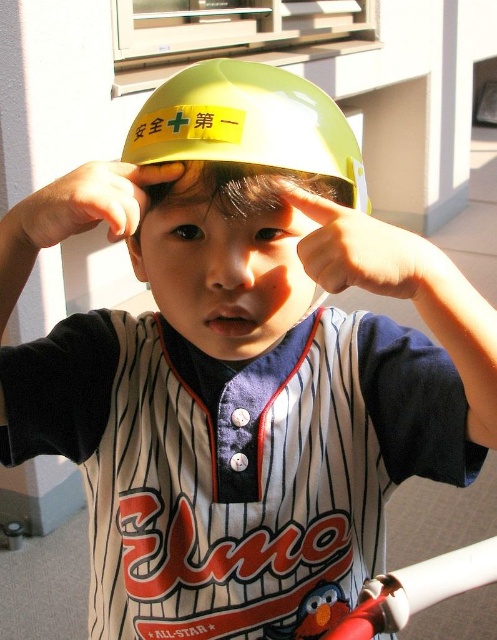
Question: Based on their relative distances, which object is nearer to the yellow matte helmet at center?

Choices:
 (A) matte yellow finger at upper center
 (B) matte yellow finger at center
 (C) white plastic baseball bat at lower right

Answer: (B)

Question: Which point appears closest to the camera in this image?

Choices:
 (A) pos(155,125)
 (B) pos(491,580)

Answer: (A)

Question: Does yellow matte helmet at center come in front of matte yellow finger at center?

Choices:
 (A) no
 (B) yes

Answer: (A)

Question: Is matte yellow finger at center smaller than white plastic baseball bat at lower right?

Choices:
 (A) no
 (B) yes

Answer: (B)

Question: Is matte yellow finger at upper center further to the viewer compared to white plastic baseball bat at lower right?

Choices:
 (A) yes
 (B) no

Answer: (B)

Question: Which of the following is the closest to the observer?

Choices:
 (A) (452, 582)
 (B) (193, 81)
 (C) (90, 212)
 (D) (305, 253)

Answer: (C)